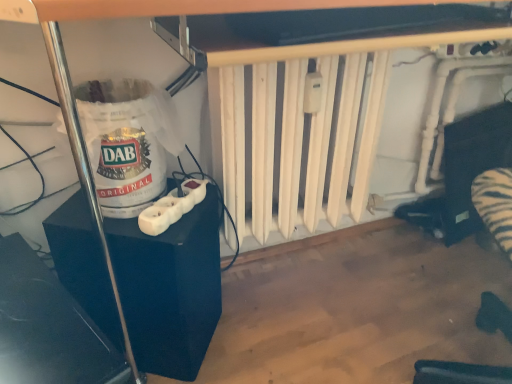
Question: From the image's perspective, is glossy plastic speaker at lower left over white plastic wii controller at lower left?

Choices:
 (A) yes
 (B) no

Answer: (B)

Question: Can you confirm if glossy plastic speaker at lower left is positioned to the left of white plastic wii controller at lower left?

Choices:
 (A) yes
 (B) no

Answer: (A)

Question: From a real-world perspective, is glossy plastic speaker at lower left positioned over white plastic wii controller at lower left based on gravity?

Choices:
 (A) yes
 (B) no

Answer: (B)

Question: Can you confirm if glossy plastic speaker at lower left is wider than white plastic wii controller at lower left?

Choices:
 (A) yes
 (B) no

Answer: (A)

Question: Is white plastic wii controller at lower left inside glossy plastic speaker at lower left?

Choices:
 (A) yes
 (B) no

Answer: (B)

Question: Is glossy plastic speaker at lower left positioned with its back to white plastic wii controller at lower left?

Choices:
 (A) no
 (B) yes

Answer: (A)

Question: From the image's perspective, is white plastic wii controller at lower left on white matte radiator at center?

Choices:
 (A) yes
 (B) no

Answer: (B)

Question: Is white matte radiator at center completely or partially inside white plastic wii controller at lower left?

Choices:
 (A) no
 (B) yes

Answer: (A)

Question: Is white plastic wii controller at lower left taller than white matte radiator at center?

Choices:
 (A) yes
 (B) no

Answer: (B)

Question: Would you say white plastic wii controller at lower left is a long distance from white matte radiator at center?

Choices:
 (A) no
 (B) yes

Answer: (A)

Question: Is white plastic wii controller at lower left facing away from white matte radiator at center?

Choices:
 (A) no
 (B) yes

Answer: (A)

Question: From a real-world perspective, is white plastic wii controller at lower left physically above white matte radiator at center?

Choices:
 (A) yes
 (B) no

Answer: (B)

Question: Considering the relative positions of glossy plastic speaker at lower left and black plastic power strip at left in the image provided, is glossy plastic speaker at lower left to the left of black plastic power strip at left from the viewer's perspective?

Choices:
 (A) yes
 (B) no

Answer: (A)